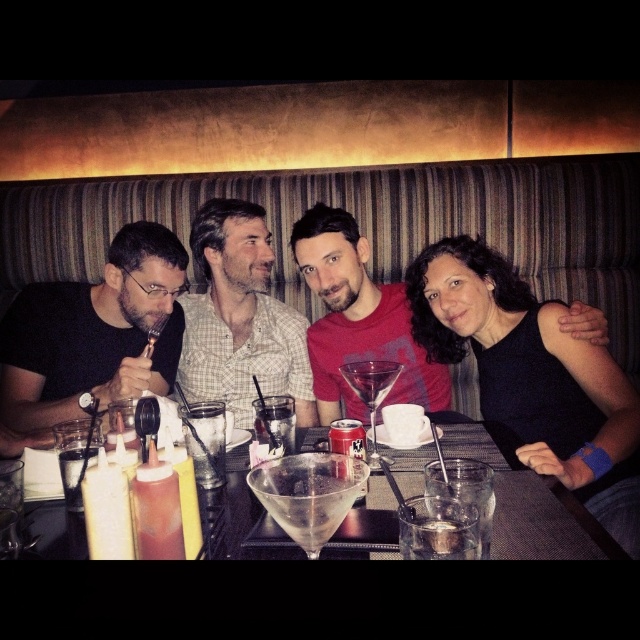
Question: Is transparent glass martini at center to the left of clear glass at table center from the viewer's perspective?

Choices:
 (A) no
 (B) yes

Answer: (A)

Question: Can you confirm if black matte fork at left is positioned to the right of transparent glass bowl at center?

Choices:
 (A) no
 (B) yes

Answer: (A)

Question: Which point is farther to the camera?

Choices:
 (A) coord(506,326)
 (B) coord(198,467)
 (C) coord(225,284)

Answer: (C)

Question: Which point is farther to the camera?

Choices:
 (A) (218, 451)
 (B) (257, 500)
 (C) (429, 298)

Answer: (C)

Question: Considering the real-world distances, which object is farthest from the black matte dress at center?

Choices:
 (A) transparent glass bowl at center
 (B) transparent glass martini at center

Answer: (B)

Question: Is black matte dress at center bigger than transparent glass martini at center?

Choices:
 (A) no
 (B) yes

Answer: (B)